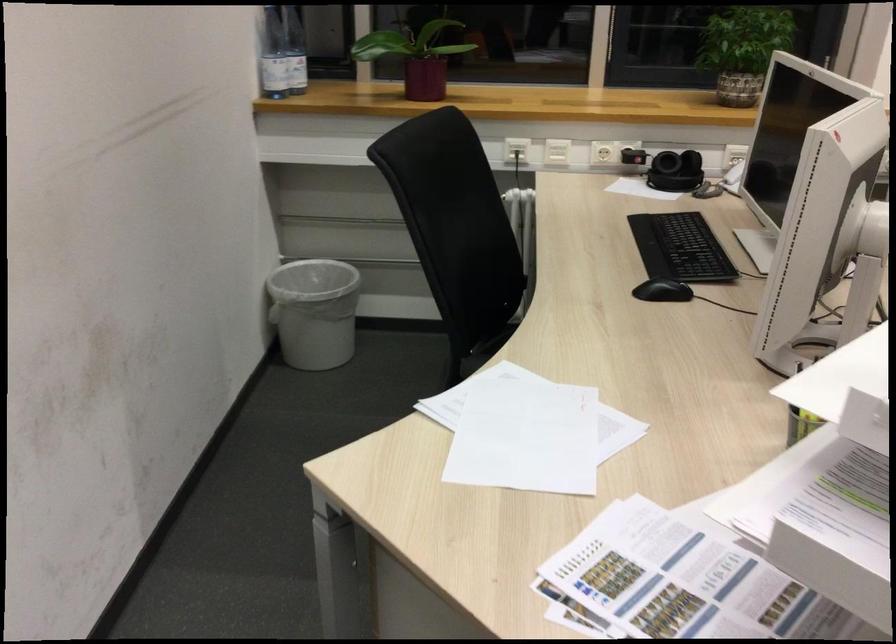
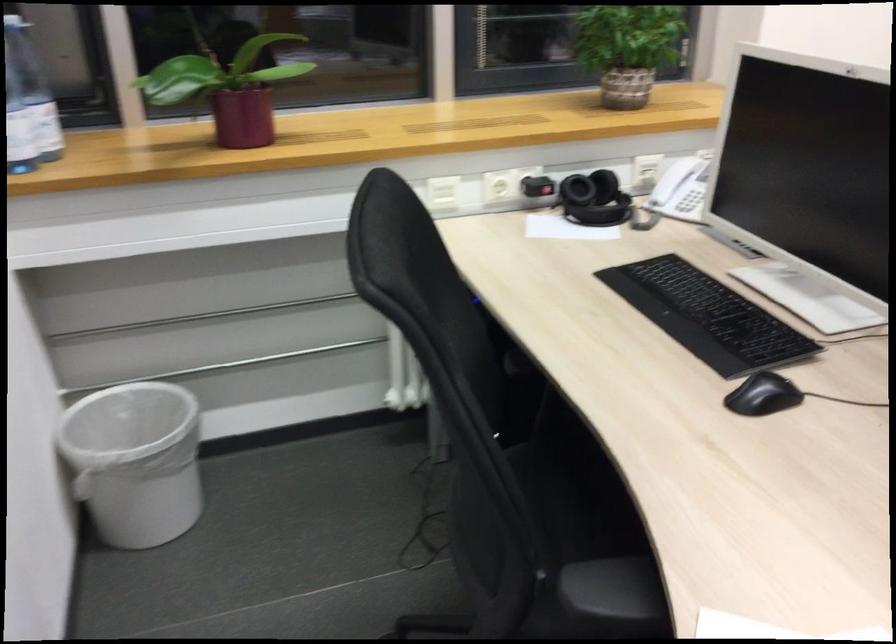
What movement of the cameraman would produce the second image?

The cameraman moved toward left, forward.